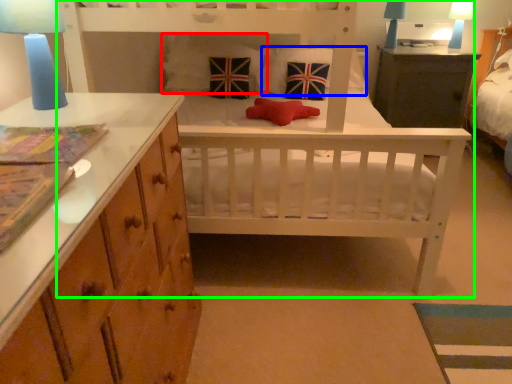
Question: Which object is positioned farthest from pillow (highlighted by a red box)? Select from pillow (highlighted by a blue box) and infant bed (highlighted by a green box).

Choices:
 (A) pillow
 (B) infant bed

Answer: (B)